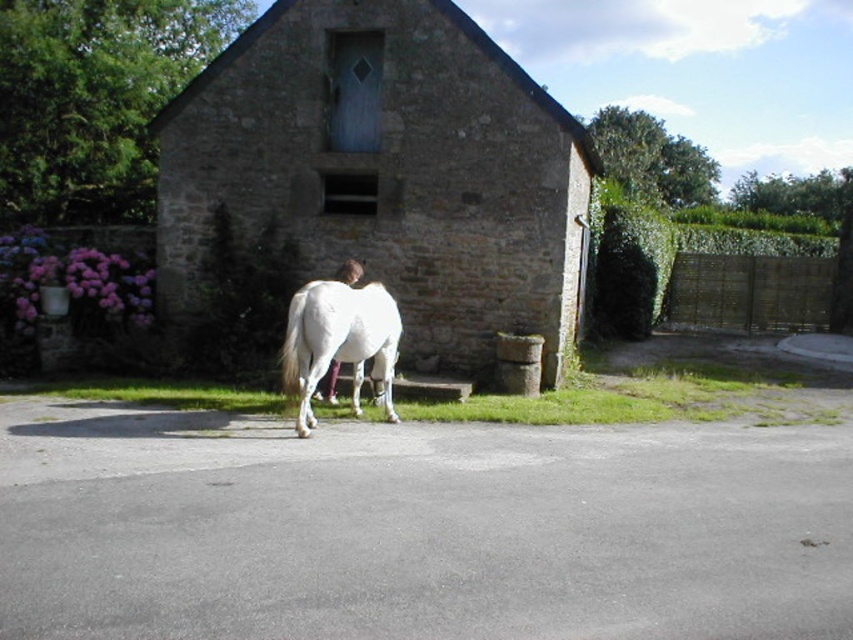
Is gray asphalt driveway at center thinner than white glossy horse at center?

Correct, gray asphalt driveway at center's width is less than white glossy horse at center's.

Between point (485, 609) and point (306, 348), which one is positioned behind?

The point (306, 348) is more distant.

Locate an element on the screen. gray asphalt driveway at center is located at coordinates (416, 529).

You are a GUI agent. You are given a task and a screenshot of the screen. Output one action in this format:
    pyautogui.click(x=<x>, y=<y>)
    Task: Click on the gray asphalt driveway at center
    The height and width of the screenshot is (640, 853).
    Given the screenshot: What is the action you would take?
    pyautogui.click(x=416, y=529)

From the picture: Who is positioned more to the left, stone barn at center or white glossy horse at center?

From the viewer's perspective, stone barn at center appears more on the left side.

Consider the image. Can you confirm if stone barn at center is thinner than white glossy horse at center?

Indeed, stone barn at center has a lesser width compared to white glossy horse at center.

Locate an element on the screen. The image size is (853, 640). stone barn at center is located at coordinates (387, 170).

Between gray asphalt driveway at center and stone barn at center, which one is positioned lower?

gray asphalt driveway at center is below.

Locate an element on the screen. This screenshot has height=640, width=853. gray asphalt driveway at center is located at coordinates (416, 529).

Locate an element on the screen. The width and height of the screenshot is (853, 640). gray asphalt driveway at center is located at coordinates (416, 529).